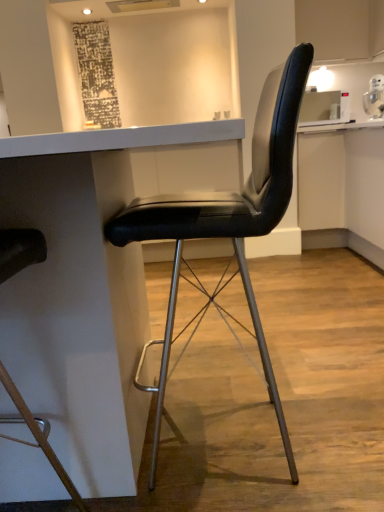
Question: Is black leather chair at center, the 2th chair positioned from the left, at the back of black leather chair at center, which is the 2th chair in right-to-left order?

Choices:
 (A) no
 (B) yes

Answer: (A)

Question: Would you say black leather chair at center, the first chair positioned from the left, contains black leather chair at center, the 1th chair when ordered from right to left?

Choices:
 (A) yes
 (B) no

Answer: (B)

Question: Is black leather chair at center, which is the 2th chair in right-to-left order, outside of black leather chair at center, the 2th chair positioned from the left?

Choices:
 (A) no
 (B) yes

Answer: (B)

Question: From a real-world perspective, is black leather chair at center, the first chair positioned from the left, over black leather chair at center, the 1th chair when ordered from right to left?

Choices:
 (A) no
 (B) yes

Answer: (B)

Question: Is black leather chair at center, which is the 2th chair in right-to-left order, positioned behind black leather chair at center, the 2th chair positioned from the left?

Choices:
 (A) no
 (B) yes

Answer: (A)

Question: Relative to white glossy table at center, is black leather chair at center, which is the 2th chair in right-to-left order, in front or behind?

Choices:
 (A) behind
 (B) front

Answer: (B)

Question: Based on their sizes in the image, would you say black leather chair at center, the first chair positioned from the left, is bigger or smaller than white glossy table at center?

Choices:
 (A) big
 (B) small

Answer: (B)

Question: Considering the positions of point (26, 410) and point (114, 268), is point (26, 410) closer or farther from the camera than point (114, 268)?

Choices:
 (A) farther
 (B) closer

Answer: (B)

Question: Is black leather chair at center, which is the 2th chair in right-to-left order, to the left or to the right of white glossy table at center in the image?

Choices:
 (A) left
 (B) right

Answer: (A)

Question: From a real-world perspective, is white glossy table at center above or below black leather chair at center, the first chair positioned from the left?

Choices:
 (A) above
 (B) below

Answer: (B)

Question: From their relative heights in the image, would you say white glossy table at center is taller or shorter than black leather chair at center, which is the 2th chair in right-to-left order?

Choices:
 (A) tall
 (B) short

Answer: (B)

Question: Is white glossy table at center in front of or behind black leather chair at center, which is the 2th chair in right-to-left order, in the image?

Choices:
 (A) behind
 (B) front

Answer: (A)

Question: Do you think white glossy table at center is within black leather chair at center, which is the 2th chair in right-to-left order, or outside of it?

Choices:
 (A) outside
 (B) inside

Answer: (A)

Question: Looking at their shapes, would you say black leather chair at center, the 1th chair when ordered from right to left, is wider or thinner than black leather chair at center, the first chair positioned from the left?

Choices:
 (A) wide
 (B) thin

Answer: (A)

Question: Is black leather chair at center, the 2th chair positioned from the left, inside the boundaries of black leather chair at center, the first chair positioned from the left, or outside?

Choices:
 (A) inside
 (B) outside

Answer: (B)